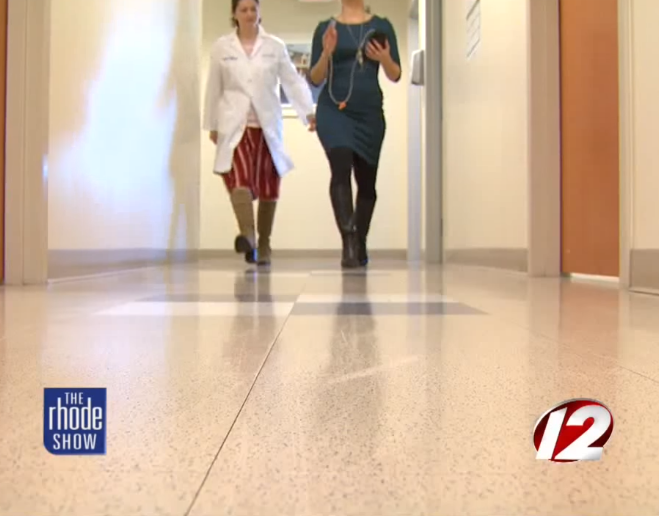
Identify the location of closed door. (588, 95).